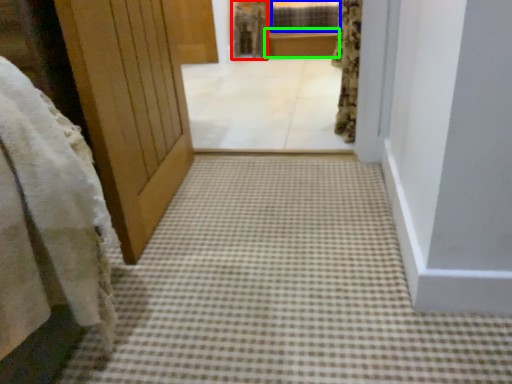
Question: Which object is the farthest from robe (highlighted by a red box)? Choose among these: window (highlighted by a blue box) or balustrade (highlighted by a green box).

Choices:
 (A) window
 (B) balustrade

Answer: (A)